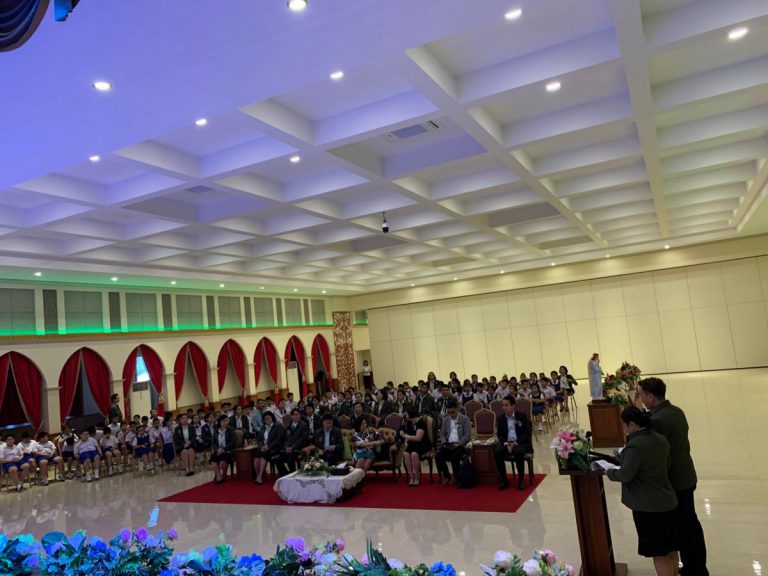
At what (x,y) coordinates should I click in order to perform the action: click on podium. Please return your answer as a coordinate pair (x, y). The height and width of the screenshot is (576, 768). Looking at the image, I should click on (594, 530).